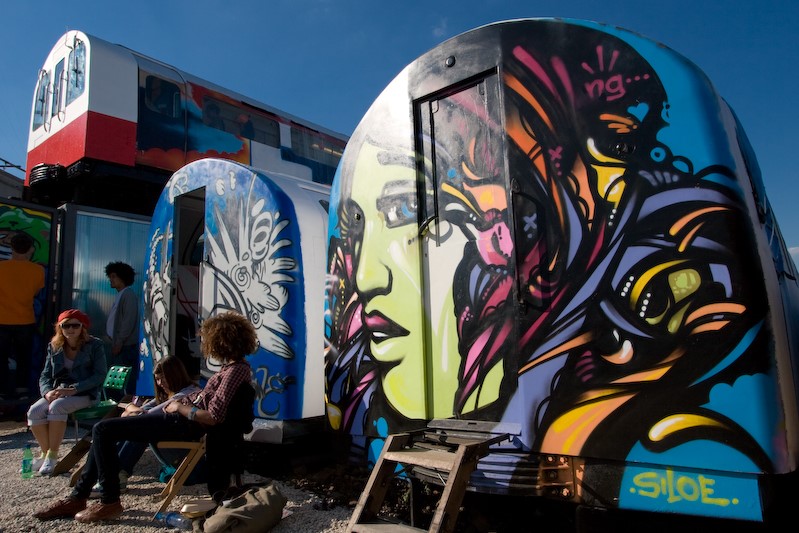
I want to click on open door, so [189, 289].